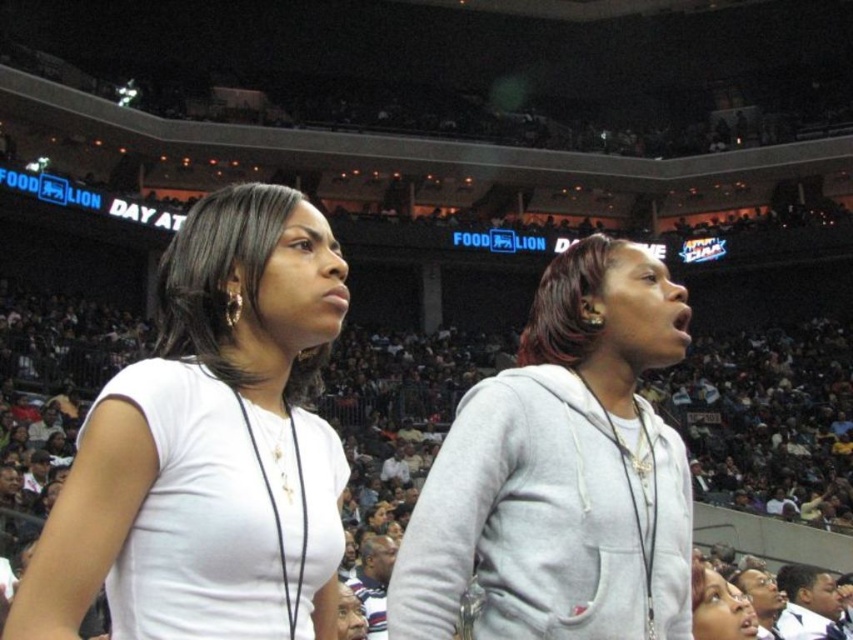
Locate an element on the screen. white matte shirt at center is located at coordinates (209, 445).

In the scene shown: Who is lower down, white matte shirt at center or gray hoodie at center?

gray hoodie at center is lower down.

Describe the element at coordinates (209, 445) in the screenshot. I see `white matte shirt at center` at that location.

The image size is (853, 640). In order to click on white matte shirt at center in this screenshot , I will do 209,445.